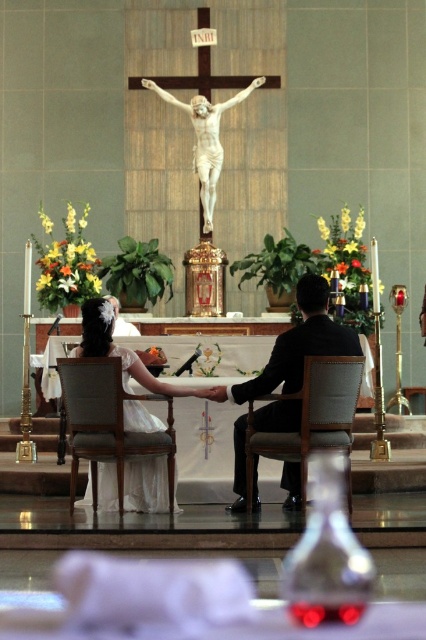
Question: Observing the image, what is the correct spatial positioning of light brown fabric chair at center in reference to light brown leather chair at center?

Choices:
 (A) left
 (B) right

Answer: (A)

Question: Which object is the farthest from the light brown fabric chair at center?

Choices:
 (A) white satin dress at center
 (B) light brown leather chair at center

Answer: (B)

Question: Can you confirm if light brown fabric chair at center is positioned above light brown leather chair at center?

Choices:
 (A) yes
 (B) no

Answer: (B)

Question: Is light brown fabric chair at center bigger than light brown leather chair at center?

Choices:
 (A) yes
 (B) no

Answer: (A)

Question: Which object appears closest to the camera in this image?

Choices:
 (A) light brown leather chair at center
 (B) light brown fabric chair at center

Answer: (A)

Question: Which point is closer to the camera?

Choices:
 (A) (267, 451)
 (B) (97, 452)

Answer: (B)